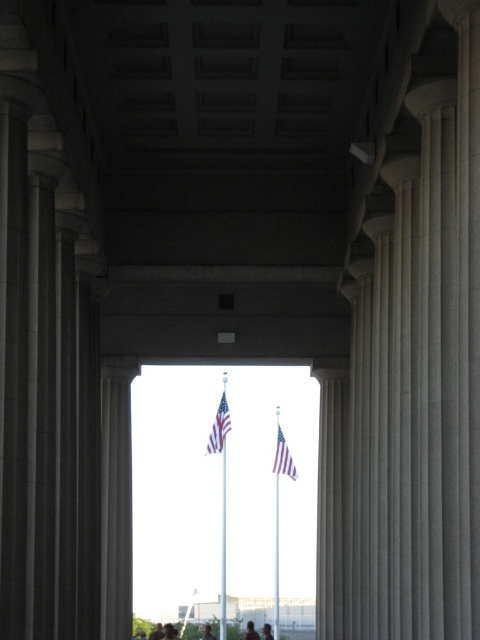
You are standing inside a grand building with columns and looking out through them. You see two people with dark brown hair at center and light brown hair at center. Which person is shorter?

The dark brown hair at center is not as tall as light brown hair at center, so the person with dark brown hair at center is shorter.

You are standing inside the grand structure looking out through the columns. You see a point marked at coordinates (283, 458). Based on the scene description, what object is this point located on?

The point at (283, 458) is located on the white fabric flag at center.